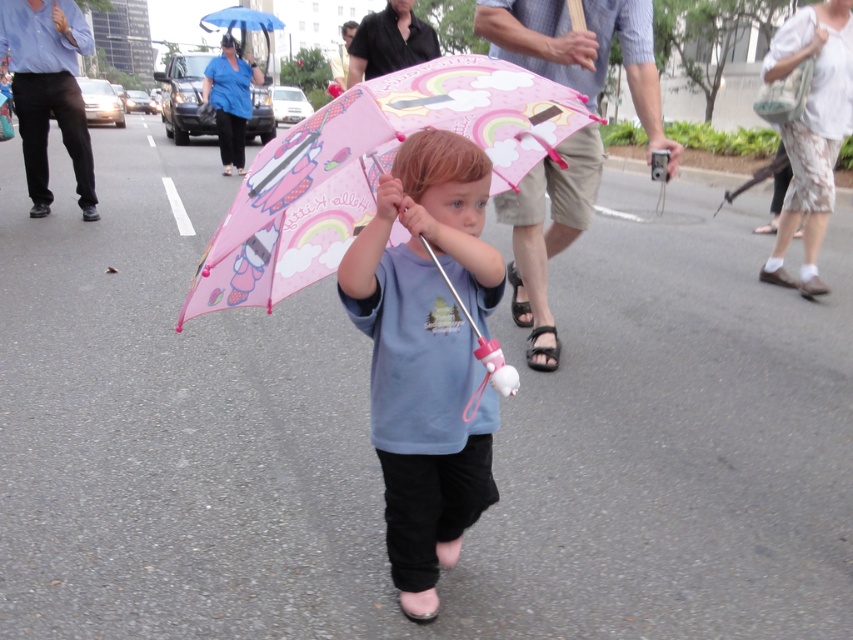
Please look at the scene and identify which object is taller between the matte pink umbrella at center and the pink matte umbrella at center. Note that both umbrellas are positioned at the same central location in the image.

The matte pink umbrella at center is taller than the pink matte umbrella at center according to the description.

You are standing at the center of the image and want to locate the matte pink umbrella at center. According to the coordinates provided, in which direction should you look to find it?

The matte pink umbrella at center is located at coordinates point [426,353]. Since you are at the center of the image, which is point [426,320], you should look slightly to the right and slightly downward to find it.